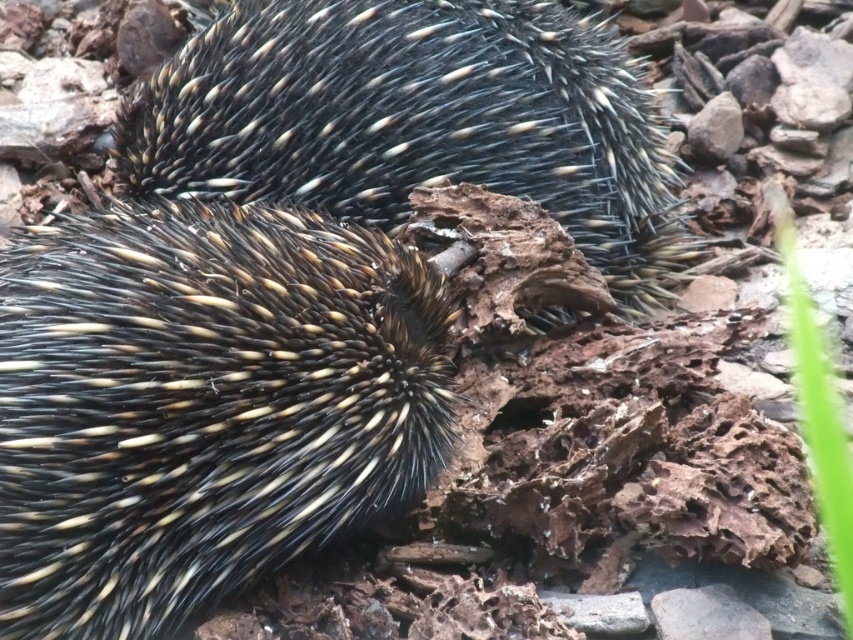
Question: Is black spiny hedgehog at center above spiny black hedgehog at center?

Choices:
 (A) no
 (B) yes

Answer: (A)

Question: Is black spiny hedgehog at center smaller than spiny black hedgehog at center?

Choices:
 (A) yes
 (B) no

Answer: (A)

Question: Which point is farther from the camera taking this photo?

Choices:
 (A) (308, 22)
 (B) (238, 420)

Answer: (A)

Question: Can you confirm if black spiny hedgehog at center is positioned to the right of spiny black hedgehog at center?

Choices:
 (A) yes
 (B) no

Answer: (B)